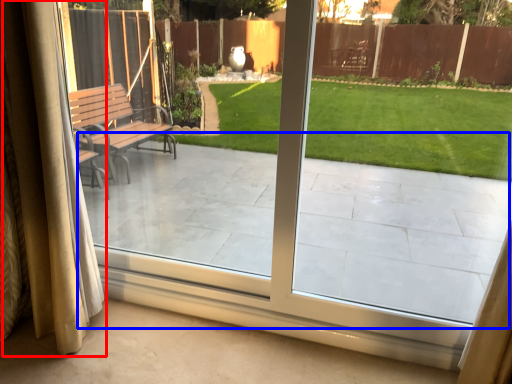
Question: Which object appears closest to the camera in this image, curtain (highlighted by a red box) or porch (highlighted by a blue box)?

Choices:
 (A) curtain
 (B) porch

Answer: (B)